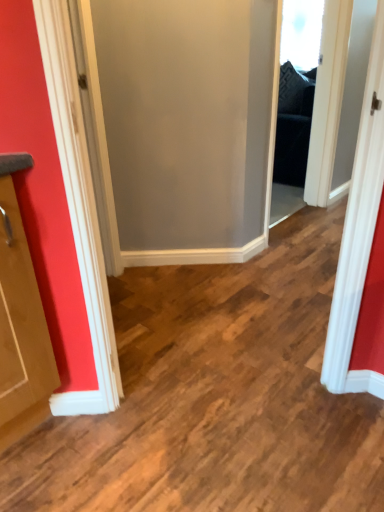
What do you see at coordinates (295, 103) in the screenshot? This screenshot has height=512, width=384. I see `black fabric screen door at upper right` at bounding box center [295, 103].

This screenshot has width=384, height=512. What are the coordinates of `black fabric screen door at upper right` in the screenshot? It's located at (295, 103).

In order to click on black fabric screen door at upper right in this screenshot , I will do `click(295, 103)`.